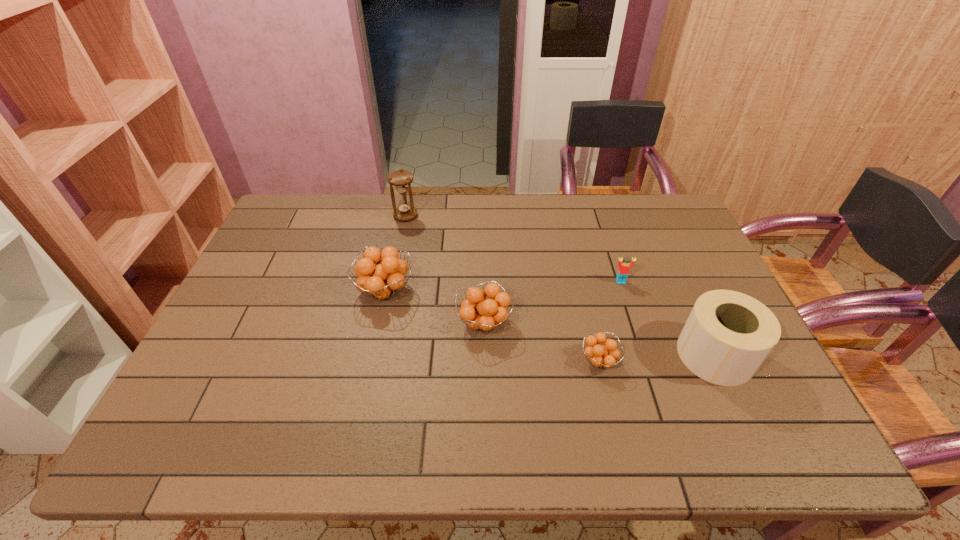
Image resolution: width=960 pixels, height=540 pixels. I want to click on free space located on the left of the second shortest orange fruit, so click(x=393, y=323).

Identify the location of free space located on the right of the shortest orange fruit. (708, 361).

Find the location of a particular element. vacant space situated 0.150m on the right of the hourglass is located at coordinates (461, 216).

Where is `vacant space located on the face of the Lego`? This screenshot has height=540, width=960. vacant space located on the face of the Lego is located at coordinates (647, 361).

Find the location of a particular element. Image resolution: width=960 pixels, height=540 pixels. vacant space located on the back of the rightmost object is located at coordinates (681, 282).

This screenshot has width=960, height=540. Find the location of `object that is at the far edge`. object that is at the far edge is located at coordinates (401, 179).

Image resolution: width=960 pixels, height=540 pixels. I want to click on orange fruit positioned at the near edge, so click(604, 356).

Locate an element on the screen. This screenshot has height=540, width=960. toilet tissue located at the near edge is located at coordinates (728, 335).

This screenshot has height=540, width=960. Identify the location of object positioned at the right edge. (728, 335).

Identify the location of object at the near right corner. (728, 335).